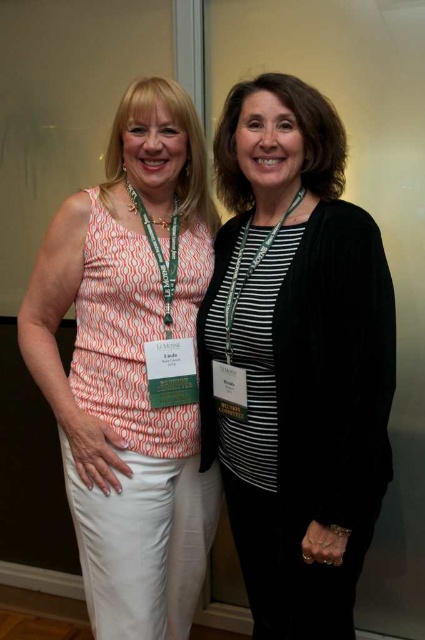
In the scene shown: Between black velvet cardigan at center and white cotton tank top at center, which one appears on the right side from the viewer's perspective?

black velvet cardigan at center

Is point (374, 296) positioned behind point (51, 234)?

No, it is not.

Is point (336, 429) positioned in front of point (161, 243)?

That is True.

At what (x,y) coordinates should I click in order to perform the action: click on black velvet cardigan at center. Please return your answer as a coordinate pair (x, y). This screenshot has height=640, width=425. Looking at the image, I should click on point(295,358).